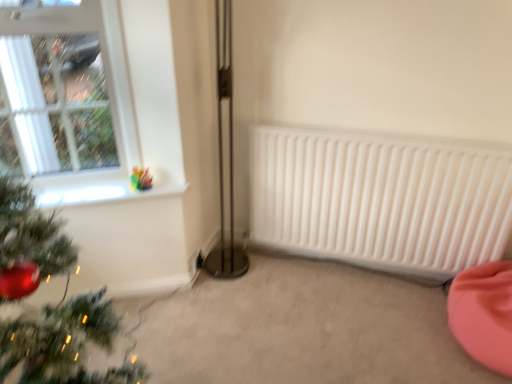
The height and width of the screenshot is (384, 512). In order to click on white glass window at upper left in this screenshot , I will do (x=66, y=99).

Describe the element at coordinates (484, 313) in the screenshot. The image size is (512, 384). I see `pink fabric bean bag at lower right` at that location.

At what (x,y) coordinates should I click in order to perform the action: click on white glass window at upper left. Please return your answer as a coordinate pair (x, y). Looking at the image, I should click on (66, 99).

Is pink fabric bean bag at lower right smaller than white glass window at upper left?

Incorrect, pink fabric bean bag at lower right is not smaller in size than white glass window at upper left.

Is pink fabric bean bag at lower right not near white glass window at upper left?

pink fabric bean bag at lower right is far away from white glass window at upper left.

Which object is further away from the camera taking this photo, pink fabric bean bag at lower right or white glass window at upper left?

white glass window at upper left.

Identify the location of bean bag chair directly beneath the white glass window at upper left (from a real-world perspective). This screenshot has width=512, height=384. (484, 313).

Is white glass window at upper left at the right side of pink fabric bean bag at lower right?

In fact, white glass window at upper left is to the left of pink fabric bean bag at lower right.

Considering the relative sizes of white glass window at upper left and pink fabric bean bag at lower right in the image provided, is white glass window at upper left smaller than pink fabric bean bag at lower right?

Correct, white glass window at upper left occupies less space than pink fabric bean bag at lower right.

Can you confirm if white glass window at upper left is taller than pink fabric bean bag at lower right?

Indeed, white glass window at upper left has a greater height compared to pink fabric bean bag at lower right.

Does pink fabric bean bag at lower right lie behind translucent glass vase at upper left?

No, pink fabric bean bag at lower right is in front of translucent glass vase at upper left.

Is pink fabric bean bag at lower right far away from translucent glass vase at upper left?

Indeed, pink fabric bean bag at lower right is not near translucent glass vase at upper left.

Is point (509, 330) less distant than point (92, 195)?

Yes, point (509, 330) is closer to viewer.

At what (x,y) coordinates should I click in order to perform the action: click on window sill above the pink fabric bean bag at lower right (from the image's perspective). Please return your answer as a coordinate pair (x, y). The width and height of the screenshot is (512, 384). Looking at the image, I should click on (103, 193).

Does translucent glass vase at upper left have a lesser height compared to pink fabric bean bag at lower right?

Yes, translucent glass vase at upper left is shorter than pink fabric bean bag at lower right.

Which object is wider, translucent glass vase at upper left or pink fabric bean bag at lower right?

Answer: pink fabric bean bag at lower right.

Could you tell me if white glass window at upper left is facing translucent glass vase at upper left?

Yes.

Is white glass window at upper left taller or shorter than translucent glass vase at upper left?

Clearly, white glass window at upper left is taller compared to translucent glass vase at upper left.

Which point is more forward, (121, 186) or (92, 199)?

The point (92, 199) is closer to the camera.

From the image's perspective, is white glass window at upper left located above translucent glass vase at upper left?

Indeed, from the image's perspective, white glass window at upper left is shown above translucent glass vase at upper left.

Where is `window above the translucent glass vase at upper left (from a real-world perspective)`? This screenshot has height=384, width=512. window above the translucent glass vase at upper left (from a real-world perspective) is located at coordinates (66, 99).

Which of these two, translucent glass vase at upper left or white glass window at upper left, is bigger?

white glass window at upper left is bigger.

Is translucent glass vase at upper left situated inside white glass window at upper left or outside?

translucent glass vase at upper left exists outside the volume of white glass window at upper left.

From a real-world perspective, is translucent glass vase at upper left under white glass window at upper left?

Yes, from a real-world perspective, translucent glass vase at upper left is beneath white glass window at upper left.

Where is `bean bag chair on the right of white glass window at upper left`? bean bag chair on the right of white glass window at upper left is located at coordinates (484, 313).

Find the location of a particular element. The width and height of the screenshot is (512, 384). bean bag chair located below the white glass window at upper left (from the image's perspective) is located at coordinates (484, 313).

Consider the image. When comparing their distances from white glass window at upper left, does pink fabric bean bag at lower right or translucent glass vase at upper left seem further?

pink fabric bean bag at lower right lies further to white glass window at upper left than the other object.

Based on their spatial positions, is white glass window at upper left or translucent glass vase at upper left further from pink fabric bean bag at lower right?

white glass window at upper left.

Which object lies nearer to the anchor point pink fabric bean bag at lower right, translucent glass vase at upper left or white glass window at upper left?

Based on the image, translucent glass vase at upper left appears to be nearer to pink fabric bean bag at lower right.

From the picture: Which object lies further to the anchor point white glass window at upper left, translucent glass vase at upper left or pink fabric bean bag at lower right?

pink fabric bean bag at lower right.

Based on their spatial positions, is white glass window at upper left or pink fabric bean bag at lower right further from translucent glass vase at upper left?

The object further to translucent glass vase at upper left is pink fabric bean bag at lower right.

Looking at the image, which one is located closer to translucent glass vase at upper left, pink fabric bean bag at lower right or white glass window at upper left?

white glass window at upper left is positioned closer to the anchor translucent glass vase at upper left.

Find the location of a particular element. This screenshot has width=512, height=384. window sill between white glass window at upper left and pink fabric bean bag at lower right is located at coordinates (103, 193).